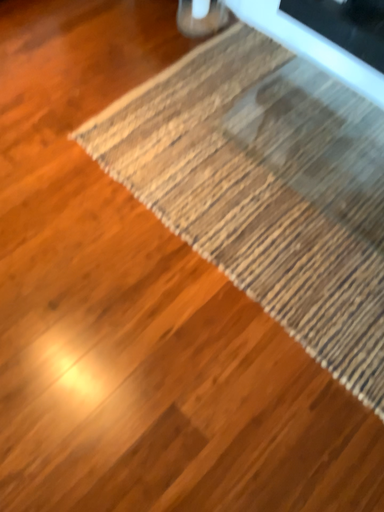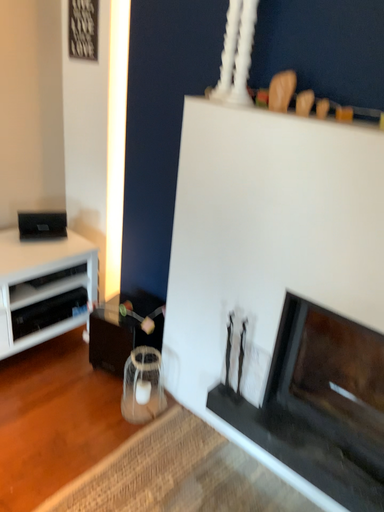
Question: How did the camera likely rotate when shooting the video?

Choices:
 (A) rotated upward
 (B) rotated downward

Answer: (A)